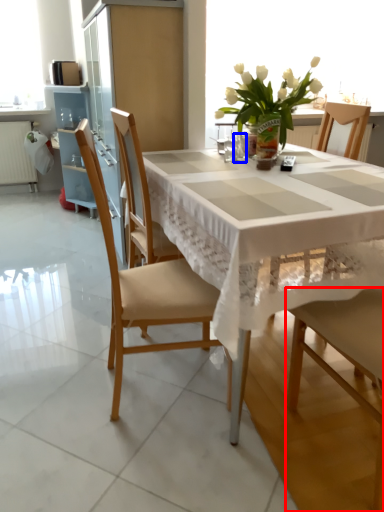
Question: Which point is further to the camera, chair (highlighted by a red box) or tableware (highlighted by a blue box)?

Choices:
 (A) chair
 (B) tableware

Answer: (B)